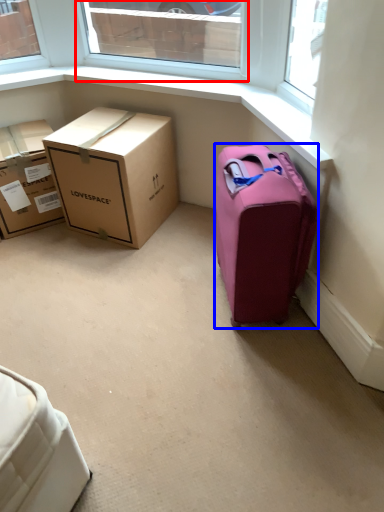
Question: Which point is closer to the camera, window (highlighted by a red box) or suitcase (highlighted by a blue box)?

Choices:
 (A) window
 (B) suitcase

Answer: (B)